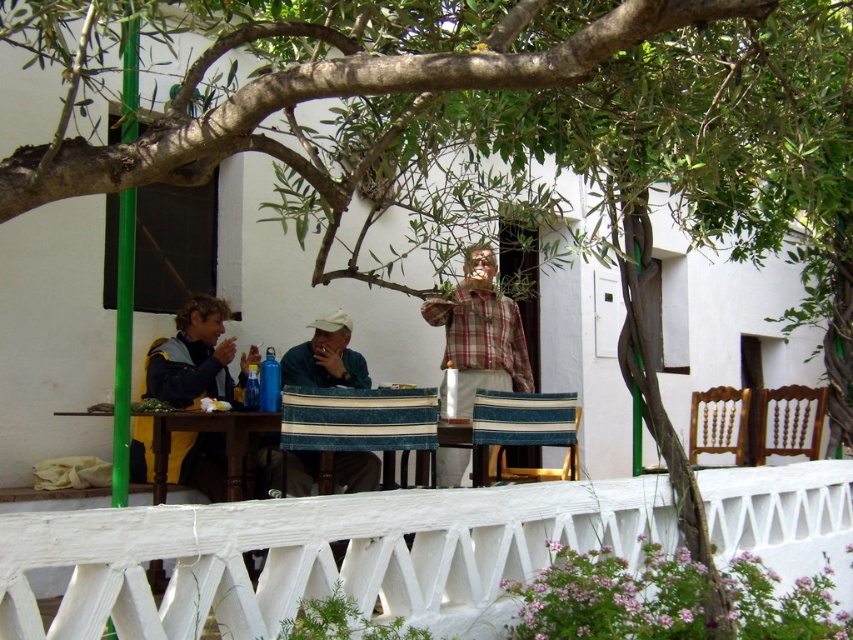
You are standing on the patio and see the plaid fabric shirt at center and the matte beige cap at center. Which object is closer to you?

The plaid fabric shirt at center is closer to you because the matte beige cap at center is behind it.